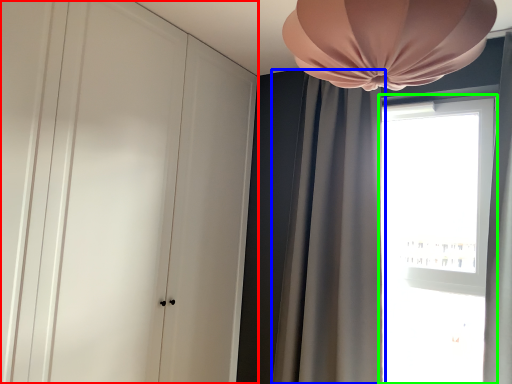
Question: Which is nearer to the dresser (highlighted by a red box)? curtain (highlighted by a blue box) or window (highlighted by a green box).

Choices:
 (A) curtain
 (B) window

Answer: (A)